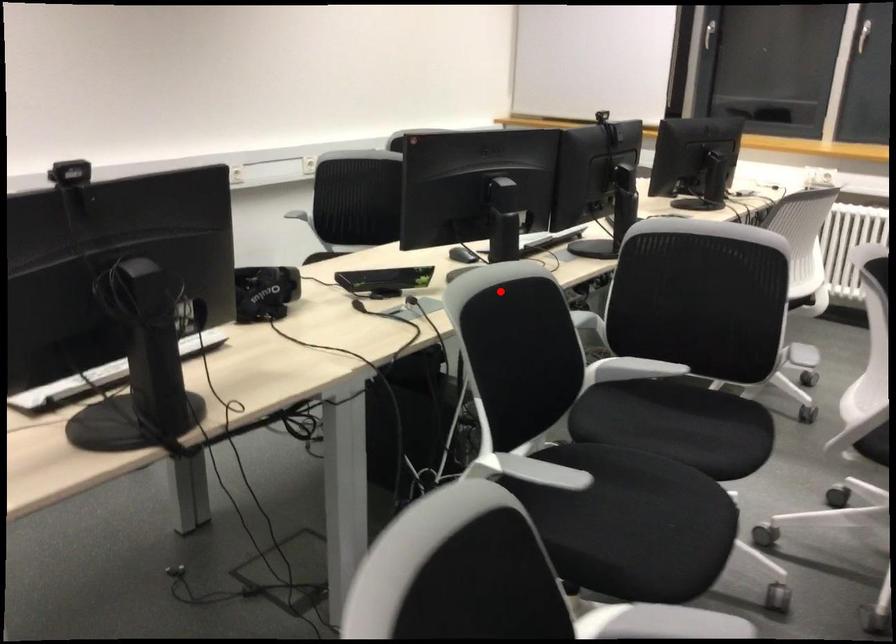
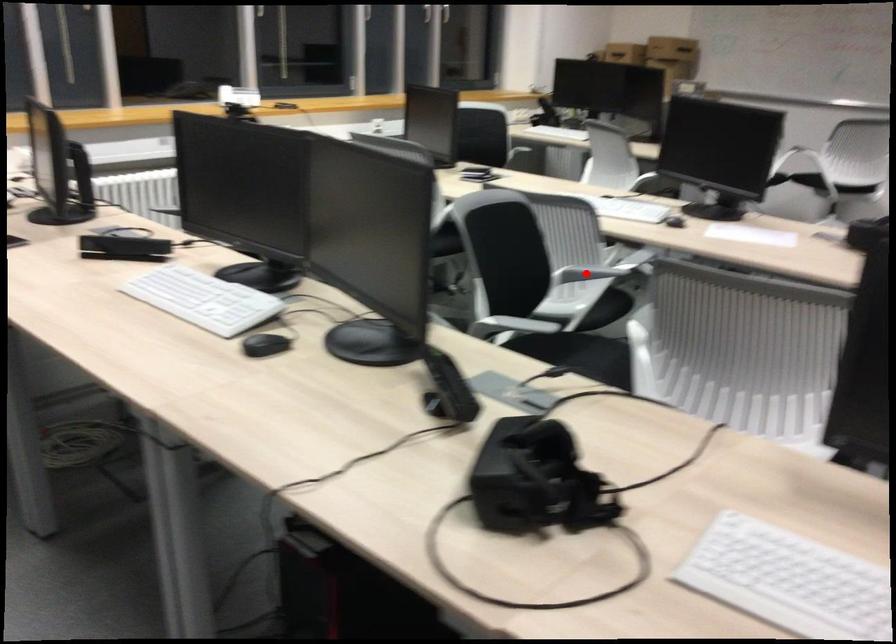
I am providing you with two images of the same scene from different viewpoints. A red point is marked on the first image and another point is marked on the second image. Does the point marked in image1 correspond to the same location as the one in image2?

No